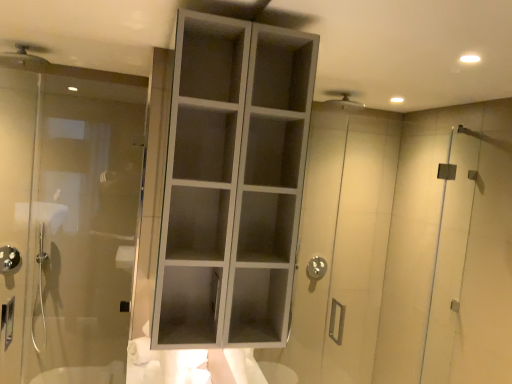
How much space does brushed metal showerhead at lower left, positioned as the 2th shower in right-to-left order, occupy horizontally?

5.53 centimeters.

In order to face brushed metal showerhead at lower left, which is the first shower in left-to-right order, should I rotate leftwards or rightwards?

Turn left approximately 30.061 degrees to face it.

What do you see at coordinates (232, 182) in the screenshot?
I see `white matte cabinet at center` at bounding box center [232, 182].

Find the location of a particular element. The height and width of the screenshot is (384, 512). matte silver shower head at upper left, positioned as the second shower in left-to-right order is located at coordinates (25, 58).

How much space does matte silver shower head at upper left, the first shower when ordered from top to bottom, occupy vertically?

matte silver shower head at upper left, the first shower when ordered from top to bottom, is 4.32 inches tall.

Find the location of a particular element. transparent glass door at left is located at coordinates (84, 230).

You are a GUI agent. You are given a task and a screenshot of the screen. Output one action in this format:
    pyautogui.click(x=<x>, y=<y>)
    Task: Click on the door positioned vertically above the brushed metal showerhead at lower left, the first shower when ordered from back to front (from a real-world perspective)
    
    Given the screenshot: What is the action you would take?
    pyautogui.click(x=84, y=230)

Do you think brushed metal showerhead at lower left, which is the first shower in left-to-right order, is within transparent glass door at left, or outside of it?

brushed metal showerhead at lower left, which is the first shower in left-to-right order, is not enclosed by transparent glass door at left.

Considering the sizes of objects brushed metal showerhead at lower left, placed as the 1th shower when sorted from bottom to top, and transparent glass door at left in the image provided, who is taller, brushed metal showerhead at lower left, placed as the 1th shower when sorted from bottom to top, or transparent glass door at left?

transparent glass door at left is taller.

Between brushed metal showerhead at lower left, placed as the 1th shower when sorted from bottom to top, and transparent glass door at left, which one appears on the right side from the viewer's perspective?

transparent glass door at left.

How different are the orientations of transparent glass door at left and matte silver shower head at upper left, the first shower when ordered from top to bottom, in degrees?

0.996 degrees separate the facing orientations of transparent glass door at left and matte silver shower head at upper left, the first shower when ordered from top to bottom.

How far apart are transparent glass door at left and matte silver shower head at upper left, the 1th shower from the front?

transparent glass door at left and matte silver shower head at upper left, the 1th shower from the front, are 34.41 inches apart from each other.

Would you consider transparent glass door at left to be distant from matte silver shower head at upper left, which appears as the 1th shower when viewed from the right?

Actually, transparent glass door at left and matte silver shower head at upper left, which appears as the 1th shower when viewed from the right, are a little close together.

In the image, is transparent glass door at left on the left side or the right side of matte silver shower head at upper left, the 1th shower from the front?

In the image, transparent glass door at left appears on the right side of matte silver shower head at upper left, the 1th shower from the front.

From a real-world perspective, who is located lower, matte silver shower head at upper left, the 1th shower from the front, or transparent glass door at left?

From a 3D spatial view, transparent glass door at left is below.

Does matte silver shower head at upper left, which is counted as the 2th shower, starting from the back, lie in front of transparent glass door at left?

No.

Between matte silver shower head at upper left, the 2th shower positioned from the bottom, and transparent glass door at left, which one has smaller width?

transparent glass door at left is thinner.

From the picture: From the image's perspective, which one is positioned lower, brushed metal showerhead at lower left, arranged as the 2th shower when viewed from the front, or matte silver shower head at upper left, the first shower when ordered from top to bottom?

brushed metal showerhead at lower left, arranged as the 2th shower when viewed from the front, is shown below in the image.

Would you consider brushed metal showerhead at lower left, the first shower when ordered from back to front, to be distant from matte silver shower head at upper left, the 2th shower positioned from the bottom?

Yes, brushed metal showerhead at lower left, the first shower when ordered from back to front, is far from matte silver shower head at upper left, the 2th shower positioned from the bottom.

Considering the relative positions of brushed metal showerhead at lower left, positioned as the 2th shower in right-to-left order, and matte silver shower head at upper left, positioned as the second shower in left-to-right order, in the image provided, is brushed metal showerhead at lower left, positioned as the 2th shower in right-to-left order, in front of matte silver shower head at upper left, positioned as the second shower in left-to-right order,?

No, brushed metal showerhead at lower left, positioned as the 2th shower in right-to-left order, is behind matte silver shower head at upper left, positioned as the second shower in left-to-right order.

From the picture: Looking at their sizes, would you say brushed metal showerhead at lower left, arranged as the 2th shower when viewed from the front, is wider or thinner than matte silver shower head at upper left, the 2th shower positioned from the bottom?

Considering their sizes, brushed metal showerhead at lower left, arranged as the 2th shower when viewed from the front, looks slimmer than matte silver shower head at upper left, the 2th shower positioned from the bottom.

What's the angular difference between matte silver shower head at upper left, positioned as the second shower in left-to-right order, and brushed metal showerhead at lower left, the first shower when ordered from back to front,'s facing directions?

The angle between the facing direction of matte silver shower head at upper left, positioned as the second shower in left-to-right order, and the facing direction of brushed metal showerhead at lower left, the first shower when ordered from back to front, is 0.987 degrees.

Locate an element on the screen. shower located behind the matte silver shower head at upper left, which is counted as the 2th shower, starting from the back is located at coordinates (9, 259).

Does matte silver shower head at upper left, the 2th shower positioned from the bottom, turn towards brushed metal showerhead at lower left, placed as the 1th shower when sorted from bottom to top?

No.

Does point (19, 47) appear closer or farther from the camera than point (11, 266)?

Point (19, 47).

In the scene shown: Which object is thinner, white matte cabinet at center or brushed metal showerhead at lower left, placed as the 1th shower when sorted from bottom to top?

brushed metal showerhead at lower left, placed as the 1th shower when sorted from bottom to top.

Where is `cupboard that appears on the right of brushed metal showerhead at lower left, arranged as the 2th shower when viewed from the front`? cupboard that appears on the right of brushed metal showerhead at lower left, arranged as the 2th shower when viewed from the front is located at coordinates (232, 182).

Could you measure the distance between white matte cabinet at center and brushed metal showerhead at lower left, the first shower when ordered from back to front?

white matte cabinet at center and brushed metal showerhead at lower left, the first shower when ordered from back to front, are 6.19 feet apart from each other.

Looking at this image, considering the relative sizes of white matte cabinet at center and brushed metal showerhead at lower left, arranged as the 2th shower when viewed from the front, in the image provided, is white matte cabinet at center shorter than brushed metal showerhead at lower left, arranged as the 2th shower when viewed from the front,?

No, white matte cabinet at center is not shorter than brushed metal showerhead at lower left, arranged as the 2th shower when viewed from the front.

Is point (71, 265) positioned in front of point (267, 325)?

No, (71, 265) is behind (267, 325).

In terms of width, does transparent glass door at left look wider or thinner when compared to white matte cabinet at center?

transparent glass door at left is thinner than white matte cabinet at center.

Considering the sizes of objects transparent glass door at left and white matte cabinet at center in the image provided, who is smaller, transparent glass door at left or white matte cabinet at center?

With smaller size is transparent glass door at left.

Identify the location of door in front of the brushed metal showerhead at lower left, which is the first shower in left-to-right order. (84, 230).

Image resolution: width=512 pixels, height=384 pixels. I want to click on door to the right of matte silver shower head at upper left, which appears as the 1th shower when viewed from the right, so click(x=84, y=230).

Based on their spatial positions, is transparent glass door at left or white matte cabinet at center further from brushed metal showerhead at lower left, the first shower when ordered from back to front?

white matte cabinet at center is further to brushed metal showerhead at lower left, the first shower when ordered from back to front.

When comparing their distances from transparent glass door at left, does matte silver shower head at upper left, the 1th shower from the front, or white matte cabinet at center seem closer?

matte silver shower head at upper left, the 1th shower from the front, is positioned closer to the anchor transparent glass door at left.

From the image, which object appears to be nearer to brushed metal showerhead at lower left, positioned as the 2th shower in right-to-left order, white matte cabinet at center or transparent glass door at left?

The object closer to brushed metal showerhead at lower left, positioned as the 2th shower in right-to-left order, is transparent glass door at left.

Which object lies further to the anchor point transparent glass door at left, brushed metal showerhead at lower left, arranged as the 2th shower when viewed from the front, or white matte cabinet at center?

white matte cabinet at center is further to transparent glass door at left.

Estimate the real-world distances between objects in this image. Which object is closer to brushed metal showerhead at lower left, which is the first shower in left-to-right order, matte silver shower head at upper left, which is counted as the 2th shower, starting from the back, or transparent glass door at left?

Among the two, transparent glass door at left is located nearer to brushed metal showerhead at lower left, which is the first shower in left-to-right order.

From the image, which object appears to be farther from white matte cabinet at center, brushed metal showerhead at lower left, placed as the 1th shower when sorted from bottom to top, or matte silver shower head at upper left, the 2th shower positioned from the bottom?

brushed metal showerhead at lower left, placed as the 1th shower when sorted from bottom to top, lies further to white matte cabinet at center than the other object.

Consider the image. Based on their spatial positions, is white matte cabinet at center or brushed metal showerhead at lower left, which is the first shower in left-to-right order, closer to matte silver shower head at upper left, which is counted as the 2th shower, starting from the back?

brushed metal showerhead at lower left, which is the first shower in left-to-right order, lies closer to matte silver shower head at upper left, which is counted as the 2th shower, starting from the back, than the other object.

Looking at the image, which one is located further to white matte cabinet at center, matte silver shower head at upper left, the 1th shower from the front, or brushed metal showerhead at lower left, which is the first shower in left-to-right order?

Based on the image, brushed metal showerhead at lower left, which is the first shower in left-to-right order, appears to be further to white matte cabinet at center.

Locate an element on the screen. door between matte silver shower head at upper left, the 2th shower positioned from the bottom, and white matte cabinet at center from left to right is located at coordinates (84, 230).

Where is `door between white matte cabinet at center and brushed metal showerhead at lower left, the first shower when ordered from back to front, from front to back`? The image size is (512, 384). door between white matte cabinet at center and brushed metal showerhead at lower left, the first shower when ordered from back to front, from front to back is located at coordinates pos(84,230).

Where is `door between matte silver shower head at upper left, positioned as the second shower in left-to-right order, and brushed metal showerhead at lower left, the first shower when ordered from back to front, from top to bottom`? The image size is (512, 384). door between matte silver shower head at upper left, positioned as the second shower in left-to-right order, and brushed metal showerhead at lower left, the first shower when ordered from back to front, from top to bottom is located at coordinates (84, 230).

At what (x,y) coordinates should I click in order to perform the action: click on shower between white matte cabinet at center and brushed metal showerhead at lower left, arranged as the 2th shower when viewed from the front, from front to back. Please return your answer as a coordinate pair (x, y). The height and width of the screenshot is (384, 512). Looking at the image, I should click on (25, 58).